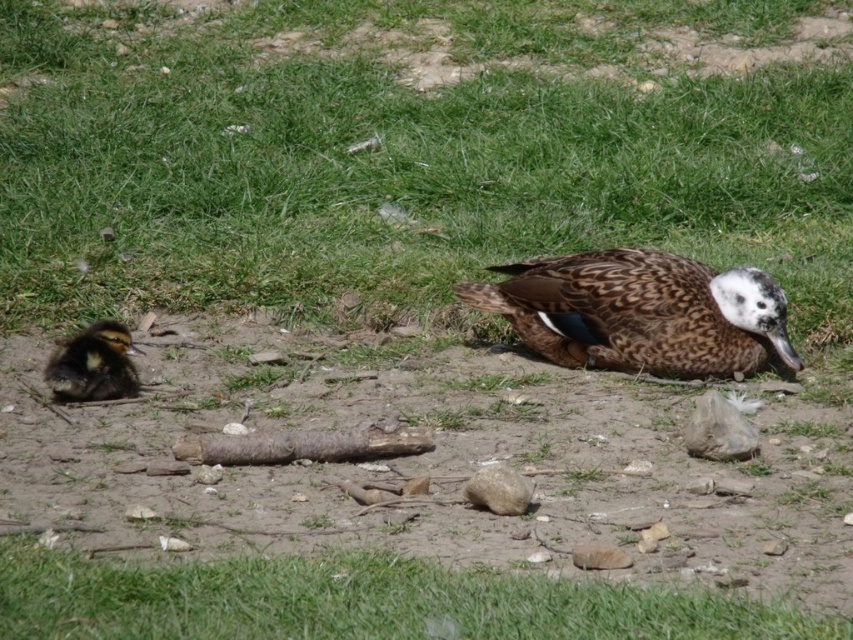
You are a gardener trying to mow the lawn. You see the green grass at lower center and the brown fluffy duckling at left. Which one is shorter in height?

The green grass at lower center is not as tall as brown fluffy duckling at left, so the green grass at lower center is shorter in height.

You are a gardener trying to plant a row of flowers in the green grass at lower center. The brown fluffy duckling at left is nearby. If you want to avoid stepping on the duckling, which area should you focus on planting?

The green grass at lower center is wider than the brown fluffy duckling at left, so you should focus on planting in the green grass at lower center to avoid stepping on the duckling.